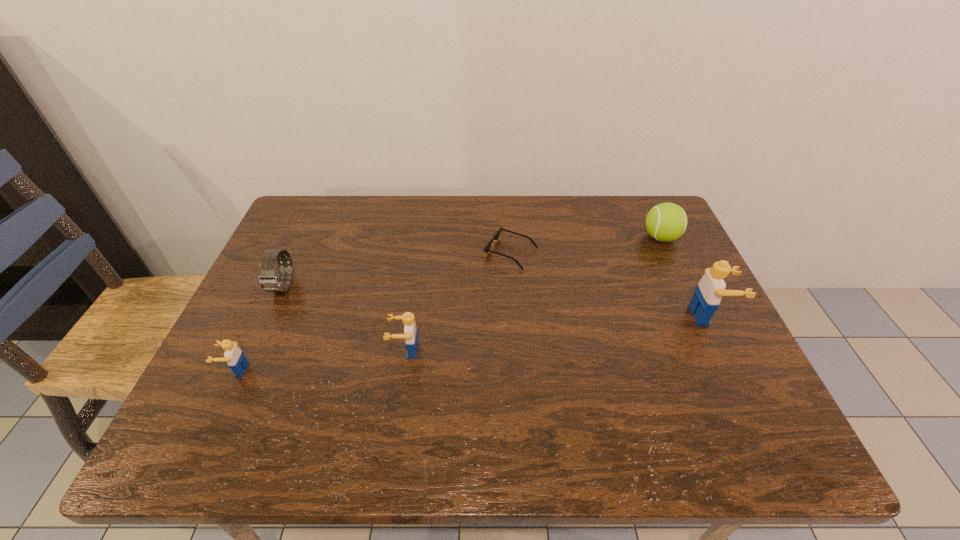
Image resolution: width=960 pixels, height=540 pixels. Find the location of `vacant space located on the face of the second Lego from right to left`. vacant space located on the face of the second Lego from right to left is located at coordinates coord(334,350).

Locate an element on the screen. The height and width of the screenshot is (540, 960). vacant space situated on the face of the second Lego from right to left is located at coordinates (307, 350).

You are a GUI agent. You are given a task and a screenshot of the screen. Output one action in this format:
    pyautogui.click(x=<x>, y=<y>)
    Task: Click on the free location located on the lenses of the sunglasses
    This screenshot has height=540, width=960.
    Given the screenshot: What is the action you would take?
    pyautogui.click(x=367, y=253)

You are a GUI agent. You are given a task and a screenshot of the screen. Output one action in this format:
    pyautogui.click(x=<x>, y=<y>)
    Task: Click on the vacant space located on the lenses of the sunglasses
    The height and width of the screenshot is (540, 960).
    Given the screenshot: What is the action you would take?
    pyautogui.click(x=356, y=253)

I want to click on free region located on the lenses of the sunglasses, so click(356, 253).

You are a GUI agent. You are given a task and a screenshot of the screen. Output one action in this format:
    pyautogui.click(x=<x>, y=<y>)
    Task: Click on the free space located 0.160m on the left of the tennis ball
    
    Given the screenshot: What is the action you would take?
    pyautogui.click(x=588, y=238)

Locate an element on the screen. This screenshot has width=960, height=540. free spot located 0.180m on the face of the watch is located at coordinates (251, 361).

The width and height of the screenshot is (960, 540). Find the location of `sunglasses that is positioned at the far edge`. sunglasses that is positioned at the far edge is located at coordinates (487, 249).

I want to click on tennis ball at the far edge, so pos(665,222).

Where is `object that is at the near edge`? object that is at the near edge is located at coordinates (234, 356).